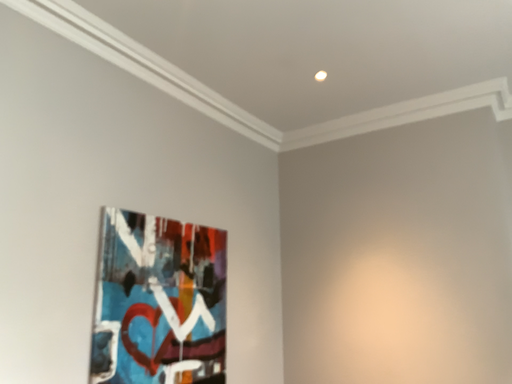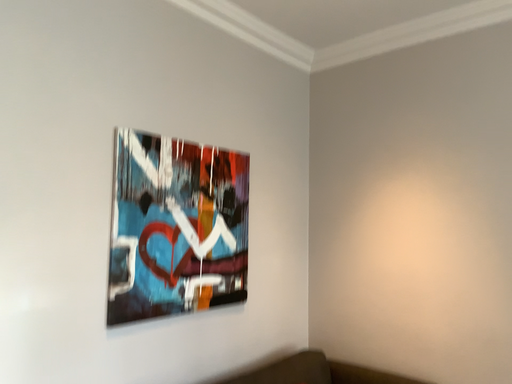
Question: How did the camera likely rotate when shooting the video?

Choices:
 (A) rotated downward
 (B) rotated upward

Answer: (A)